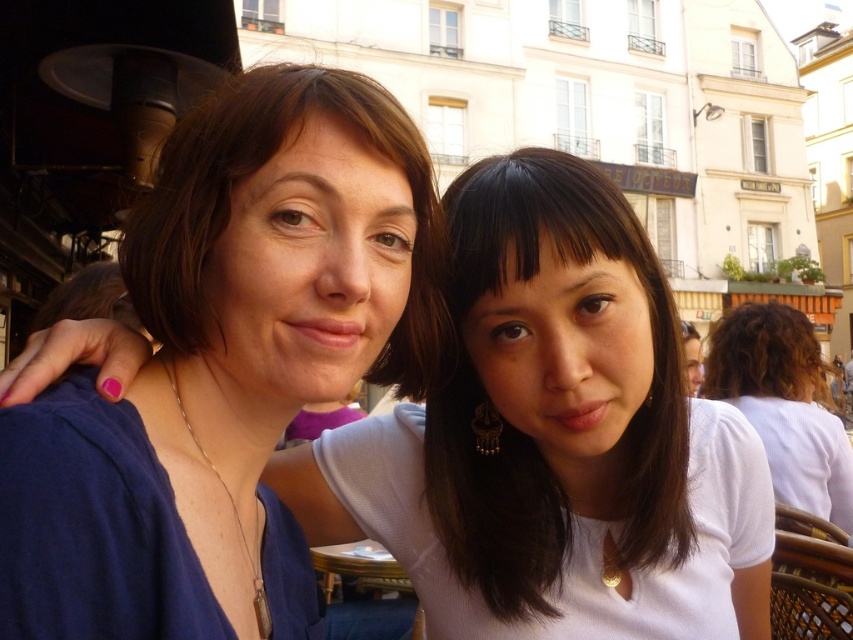
Question: Which point is farther to the camera?

Choices:
 (A) smooth white blouse at center
 (B) white matte shirt at center

Answer: (A)

Question: Can you confirm if white matte shirt at center is bigger than smooth white blouse at center?

Choices:
 (A) no
 (B) yes

Answer: (B)

Question: Which point is closer to the camera taking this photo?

Choices:
 (A) (637, 522)
 (B) (515, 588)

Answer: (B)

Question: Among these objects, which one is farthest from the camera?

Choices:
 (A) smooth white blouse at center
 (B) white matte shirt at center

Answer: (A)

Question: In this image, where is white matte shirt at center located relative to smooth white blouse at center?

Choices:
 (A) below
 (B) above

Answer: (A)

Question: Does white matte shirt at center appear over smooth white blouse at center?

Choices:
 (A) yes
 (B) no

Answer: (B)